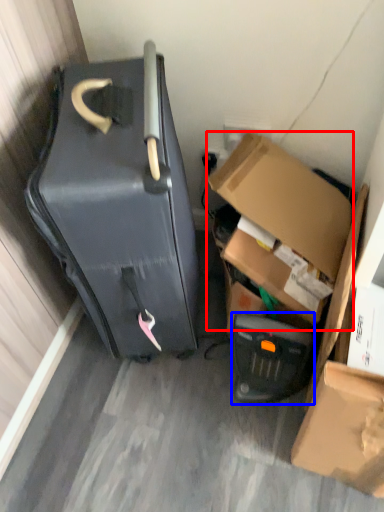
Question: Which point is closer to the camera, box (highlighted by a red box) or appliance (highlighted by a blue box)?

Choices:
 (A) box
 (B) appliance

Answer: (A)